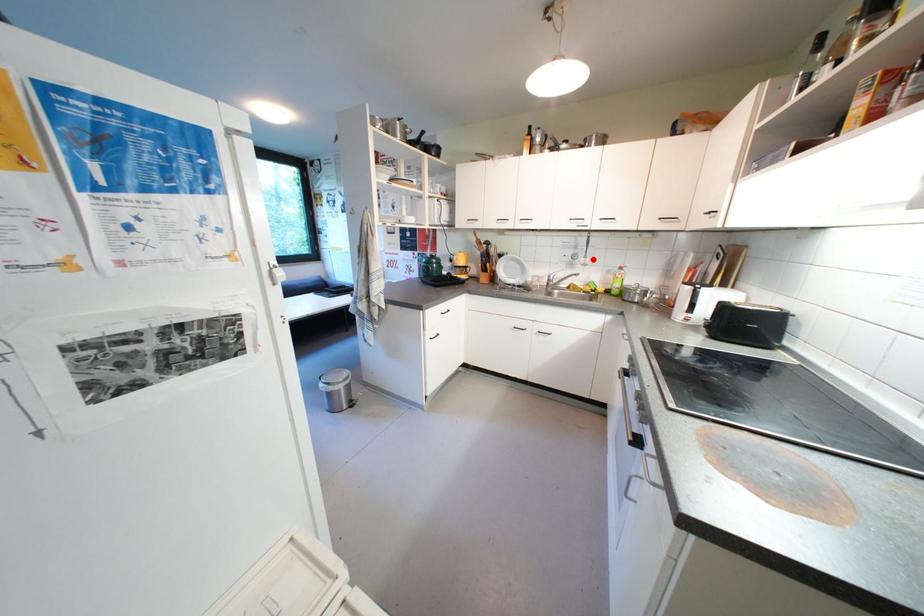
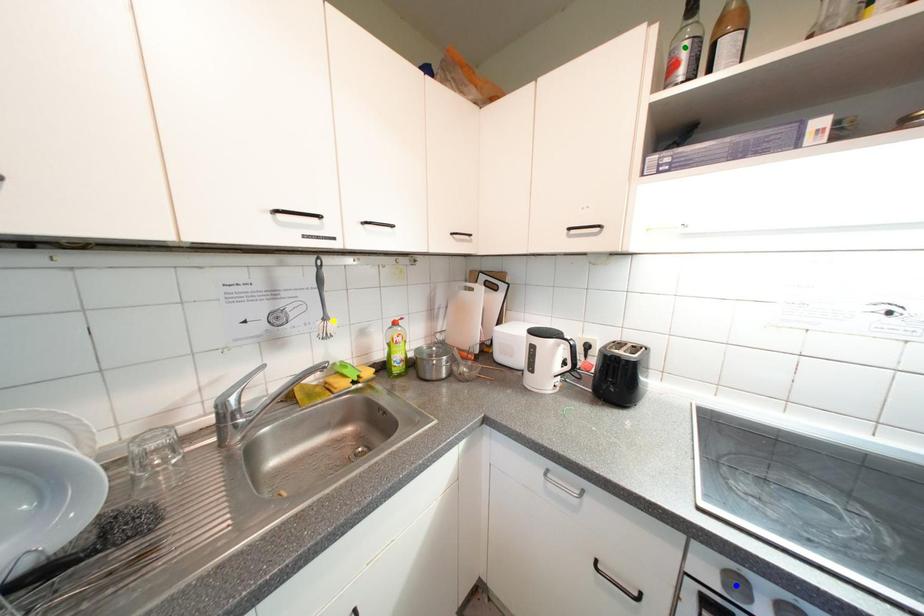
Question: I am providing you with two images of the same scene from different viewpoints. A red point is marked on the first image. You are given multiple points on the second image. Which spot in image 2 lines up with the point in image 1?

Choices:
 (A) blue point
 (B) green point
 (C) yellow point

Answer: (C)